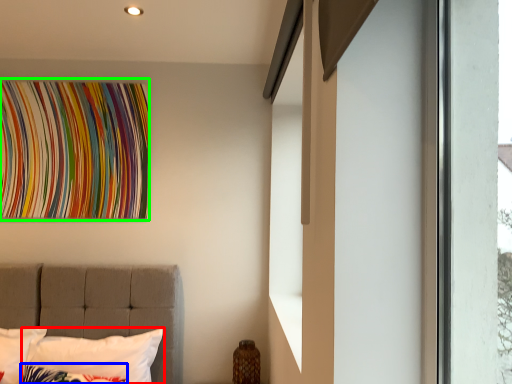
Question: Which object is the closest to the pillow (highlighted by a red box)? Choose among these: pillow (highlighted by a blue box) or tapestry (highlighted by a green box).

Choices:
 (A) pillow
 (B) tapestry

Answer: (A)